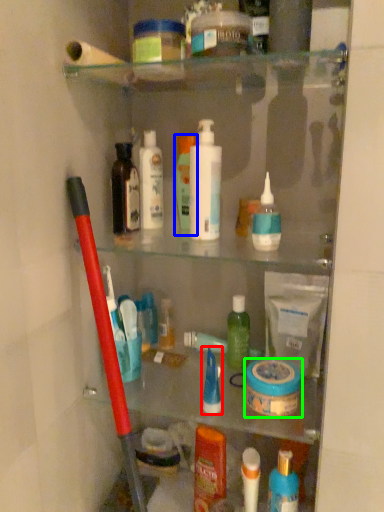
Question: Estimate the real-world distances between objects in this image. Which object is farther from toiletry (highlighted by a red box), mouthwash (highlighted by a blue box) or mouthwash (highlighted by a green box)?

Choices:
 (A) mouthwash
 (B) mouthwash

Answer: (A)